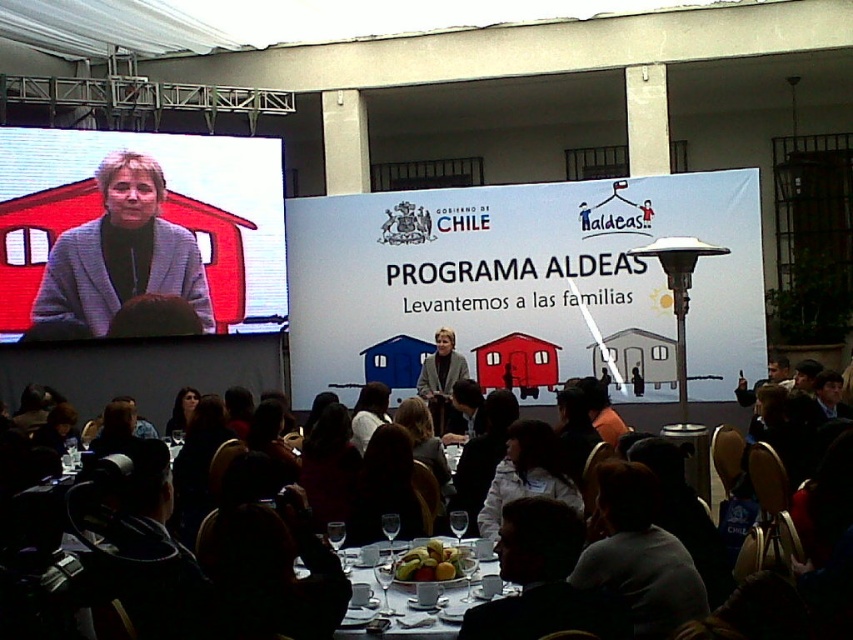
Is the position of white paperboard at center less distant than that of matte gray blazer at upper left?

Yes, white paperboard at center is closer to the viewer.

Can you confirm if white paperboard at center is shorter than matte gray blazer at upper left?

Incorrect, white paperboard at center's height does not fall short of matte gray blazer at upper left's.

Which is behind, point (361, 288) or point (158, 291)?

The point (361, 288) is behind.

At what (x,y) coordinates should I click in order to perform the action: click on white paperboard at center. Please return your answer as a coordinate pair (x, y). This screenshot has height=640, width=853. Looking at the image, I should click on (527, 285).

Can you confirm if white glossy table at center is bigger than smooth yellow fruit at center?

Yes, white glossy table at center is bigger than smooth yellow fruit at center.

Is white glossy table at center smaller than smooth yellow fruit at center?

No, white glossy table at center is not smaller than smooth yellow fruit at center.

Find the location of `white glossy table at center`. white glossy table at center is located at coordinates (415, 605).

Can you confirm if matte gray blazer at upper left is positioned below matte black chairs at center?

No.

Is matte gray blazer at upper left bigger than matte black chairs at center?

Incorrect, matte gray blazer at upper left is not larger than matte black chairs at center.

Does point (120, 154) come farther from viewer compared to point (761, 452)?

That is True.

The height and width of the screenshot is (640, 853). Identify the location of matte gray blazer at upper left. (119, 257).